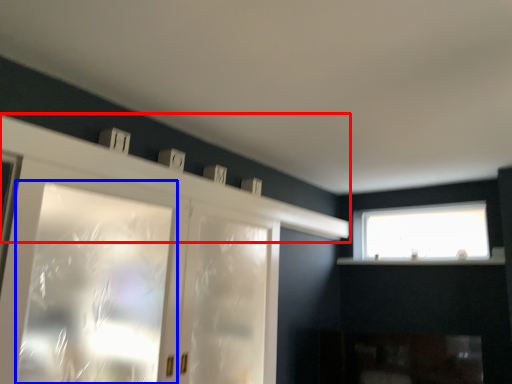
Question: Which object is closer to the camera taking this photo, mantle (highlighted by a red box) or window (highlighted by a blue box)?

Choices:
 (A) mantle
 (B) window

Answer: (B)